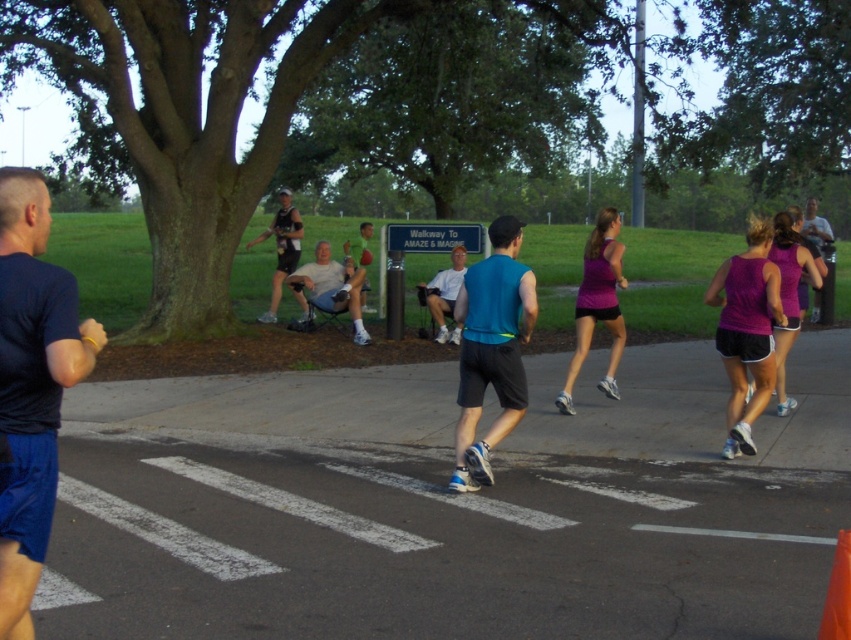
Question: Is dark blue fabric shirt at left closer to the viewer compared to matte blue tank top at center?

Choices:
 (A) no
 (B) yes

Answer: (B)

Question: Considering the relative positions of light blue fabric shirt at center and matte purple tank top at center in the image provided, where is light blue fabric shirt at center located with respect to matte purple tank top at center?

Choices:
 (A) left
 (B) right

Answer: (A)

Question: Among these objects, which one is farthest from the camera?

Choices:
 (A) light blue fabric shirt at center
 (B) purple fabric tank top at center-right
 (C) matte purple tank top at center

Answer: (A)

Question: Which of the following is the closest to the observer?

Choices:
 (A) light blue fabric shirt at center
 (B) matte blue shirt at center
 (C) purple fabric tank top at center-right

Answer: (C)

Question: Does matte blue shirt at center have a greater width compared to matte purple tank top at center?

Choices:
 (A) no
 (B) yes

Answer: (A)

Question: Which point is closer to the camera?

Choices:
 (A) (501, 216)
 (B) (329, 304)
 (C) (808, 198)

Answer: (A)